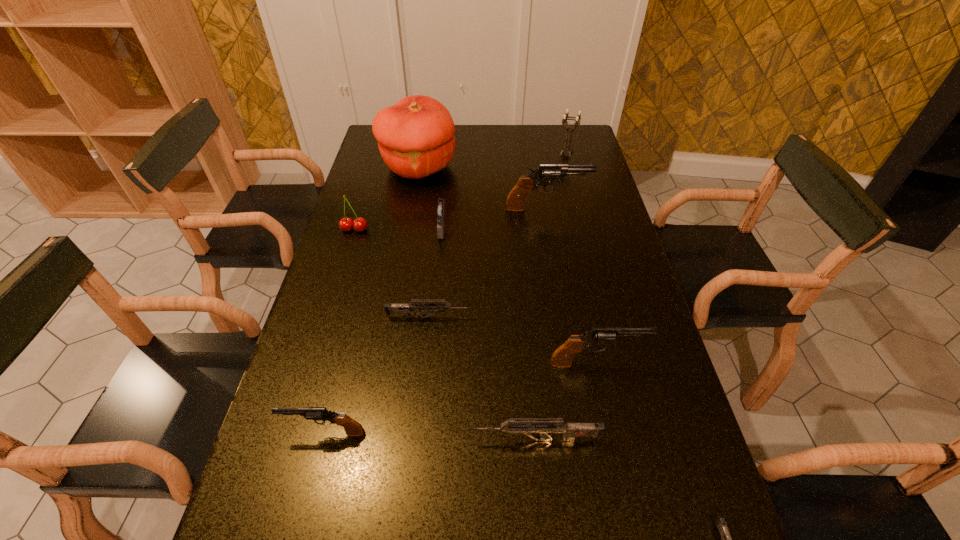
The image size is (960, 540). Identify the location of vacant point located between the pumpkin and the cherry. (387, 198).

You are a GUI agent. You are given a task and a screenshot of the screen. Output one action in this format:
    pyautogui.click(x=<x>, y=<y>)
    Task: Click on the vacant space that's between the gray igniter and the tallest object
    This screenshot has width=960, height=540.
    Given the screenshot: What is the action you would take?
    pyautogui.click(x=430, y=198)

Identify the location of free space between the tallest object and the sixth farthest object. This screenshot has width=960, height=540. (423, 242).

Locate an element on the screen. vacant space that is in between the farthest grey gun and the candle holder is located at coordinates (497, 235).

Identify which object is the seventh nearest to the fifth shortest gun. Please provide its 2D coordinates. Your answer should be formatted as a tuple, i.e. [(x, y)], where the tuple contains the x and y coordinates of a point satisfying the conditions above.

[(346, 224)]

Find the location of a particular element. The width and height of the screenshot is (960, 540). object that ranks as the fourth closest to the leftmost gun is located at coordinates [x=439, y=211].

At what (x,y) coordinates should I click in order to perform the action: click on the sixth closest gun to the gray igniter. Please return your answer as a coordinate pair (x, y). Looking at the image, I should click on (720, 522).

I want to click on gun that is the fourth closest to the second biggest black gun, so click(352, 428).

Locate which black gun ranks in proximity to the second nearest black gun. Please provide its 2D coordinates. Your answer should be formatted as a tuple, i.e. [(x, y)], where the tuple contains the x and y coordinates of a point satisfying the conditions above.

[(352, 428)]

Identify which black gun is the second closest to the candle holder. Please provide its 2D coordinates. Your answer should be formatted as a tuple, i.e. [(x, y)], where the tuple contains the x and y coordinates of a point satisfying the conditions above.

[(562, 357)]